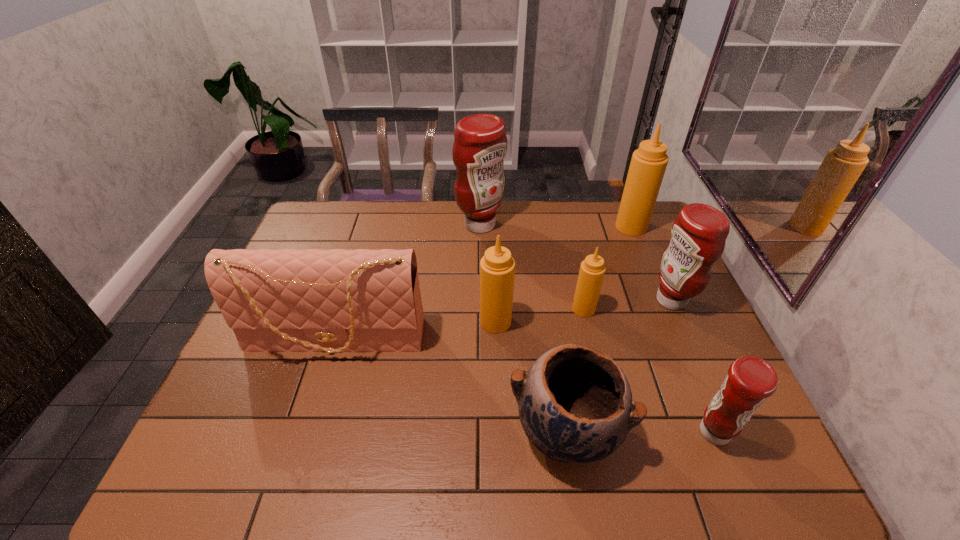
Identify the location of vacant space situated 0.210m on the right of the pottery. The width and height of the screenshot is (960, 540). (717, 432).

The image size is (960, 540). In order to click on condiment located in the near edge section of the desktop in this screenshot , I will do `click(750, 380)`.

I want to click on pottery that is positioned at the near edge, so click(x=575, y=404).

In order to click on object located at the left edge in this screenshot , I will do `click(289, 300)`.

You are a GUI agent. You are given a task and a screenshot of the screen. Output one action in this format:
    pyautogui.click(x=<x>, y=<y>)
    Task: Click on the object that is at the far right corner
    The image size is (960, 540).
    Given the screenshot: What is the action you would take?
    pyautogui.click(x=648, y=164)

Locate an element on the screen. This screenshot has width=960, height=540. object that is positioned at the near right corner is located at coordinates (750, 380).

Where is `vacant space at the far edge of the desktop`? Image resolution: width=960 pixels, height=540 pixels. vacant space at the far edge of the desktop is located at coordinates (592, 215).

Find the location of a particular element. The height and width of the screenshot is (540, 960). free space at the near edge of the desktop is located at coordinates (428, 472).

At what (x,y) coordinates should I click in order to perform the action: click on vacant area at the right edge. Please return your answer as a coordinate pair (x, y). This screenshot has width=960, height=540. Looking at the image, I should click on (665, 369).

What are the coordinates of `vacant region at the far left corner of the desktop` in the screenshot? It's located at (335, 209).